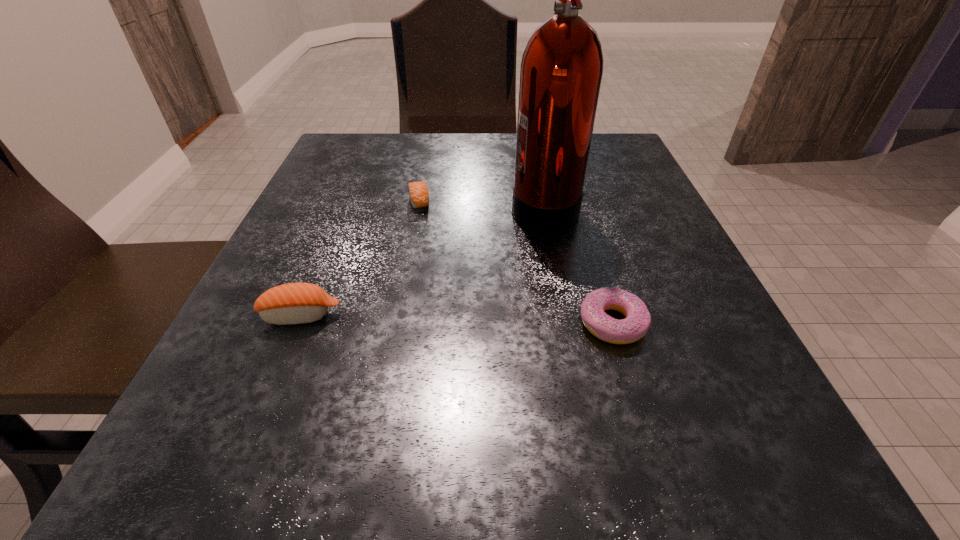
Identify the location of vacant space that is in between the third object from right to left and the nearer sushi. tap(360, 258).

Identify the location of free space between the doughnut and the right sushi. (516, 262).

The height and width of the screenshot is (540, 960). What are the coordinates of `unoccupied position between the third object from right to left and the left sushi` in the screenshot? It's located at (360, 258).

Identify which object is located as the second nearest to the shorter sushi. Please provide its 2D coordinates. Your answer should be formatted as a tuple, i.e. [(x, y)], where the tuple contains the x and y coordinates of a point satisfying the conditions above.

[(295, 303)]

Image resolution: width=960 pixels, height=540 pixels. I want to click on object identified as the closest to the right sushi, so click(x=562, y=66).

Locate an element on the screen. Image resolution: width=960 pixels, height=540 pixels. vacant space that satisfies the following two spatial constraints: 1. on the front-facing side of the tallest object; 2. on the right side of the doughnut is located at coordinates (567, 323).

Where is `free space that satisfies the following two spatial constraints: 1. on the front side of the doughnut; 2. on the left side of the taller sushi`? free space that satisfies the following two spatial constraints: 1. on the front side of the doughnut; 2. on the left side of the taller sushi is located at coordinates (298, 323).

At what (x,y) coordinates should I click in order to perform the action: click on vacant space that satisfies the following two spatial constraints: 1. on the front-facing side of the tallest object; 2. on the left side of the doughnut. Please return your answer as a coordinate pair (x, y). The height and width of the screenshot is (540, 960). Looking at the image, I should click on (567, 323).

What are the coordinates of `free space that satisfies the following two spatial constraints: 1. on the front-facing side of the doughnut; 2. on the right side of the tallest object` in the screenshot? It's located at (567, 323).

Locate an element on the screen. The height and width of the screenshot is (540, 960). vacant position in the image that satisfies the following two spatial constraints: 1. on the front-facing side of the doughnut; 2. on the right side of the tallest object is located at coordinates (567, 323).